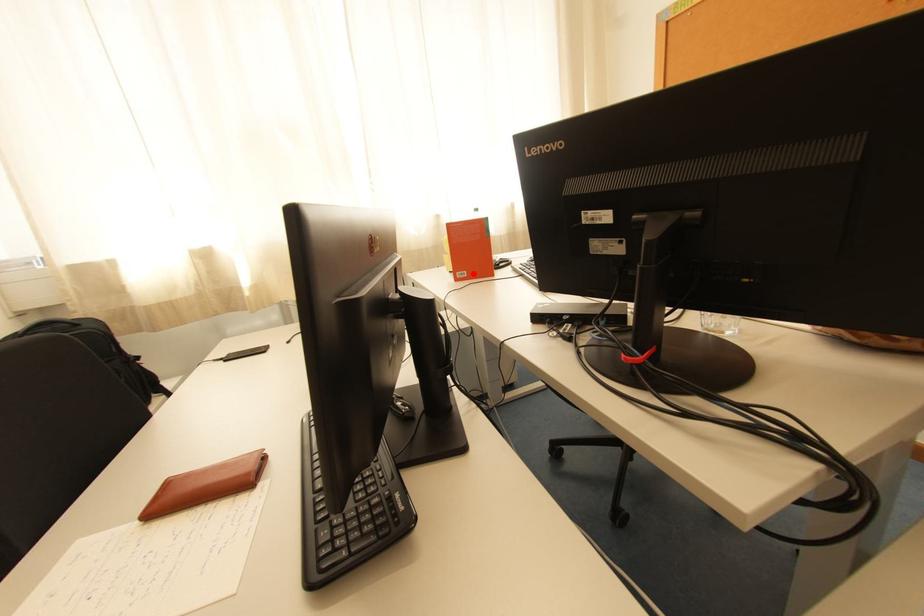
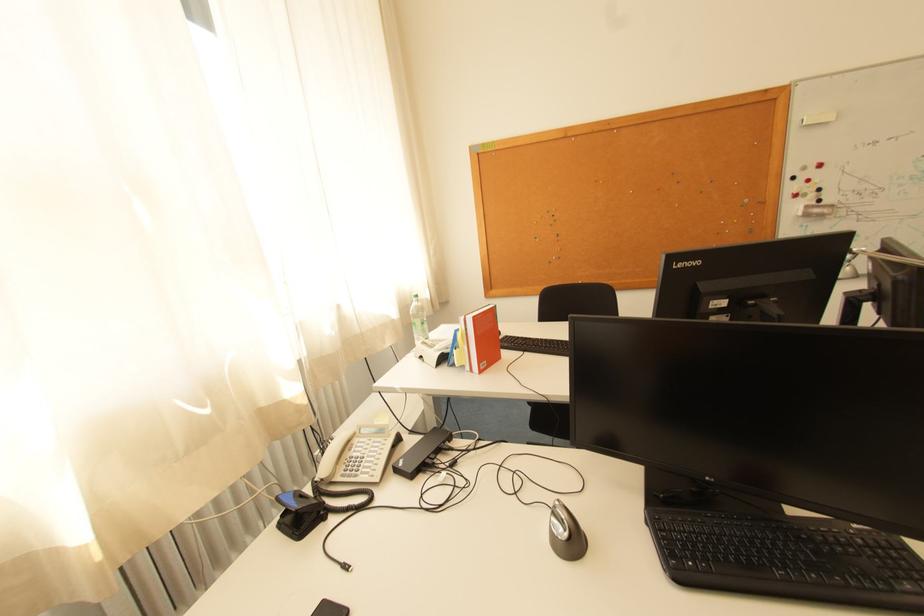
In the second image, find the point that corresponds to the highlighted location in the first image.

(493, 363)